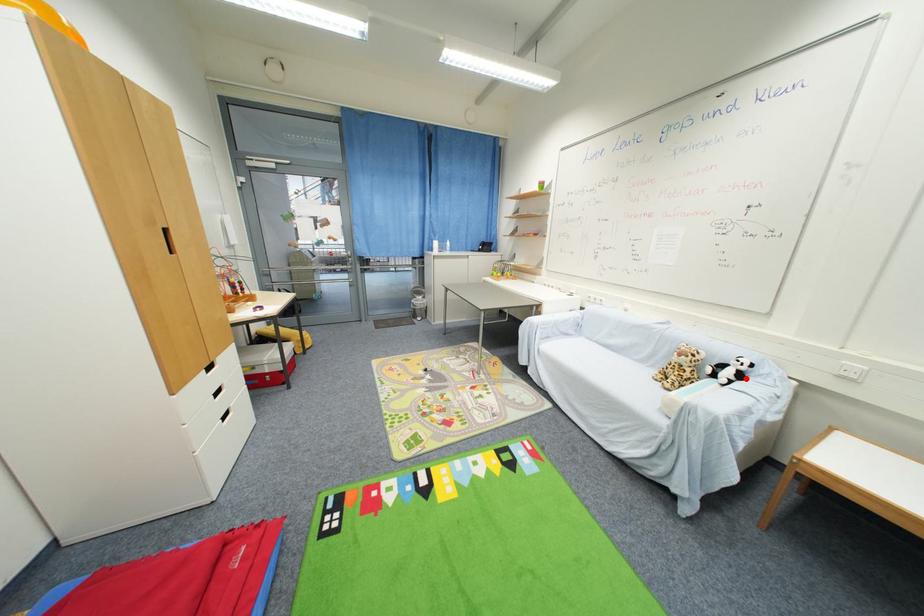
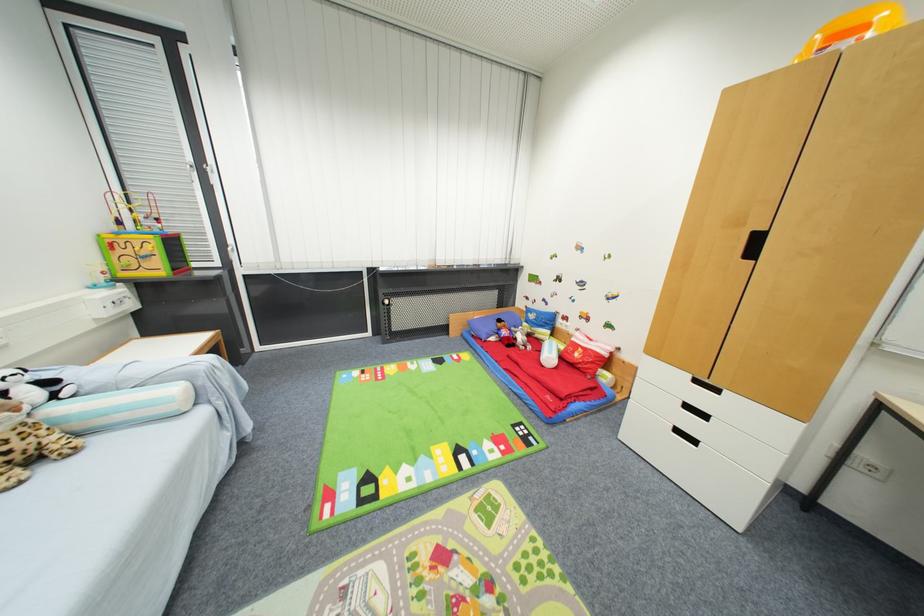
Find the pixel in the second image that matches the highlighted location in the first image.

(54, 384)